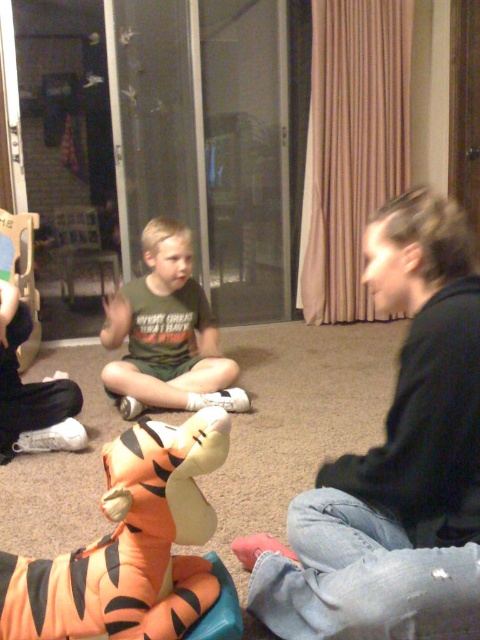
You are standing in the room and want to place a new decorative item exactly where the orange plush tiger at lower left is currently located. What are the coordinates of that location?

The coordinates of the location where the orange plush tiger at lower left is placed are at point (130,545).

You are organizing a childrens party and need to place the black cotton shirt at upper right and the orange plush tiger at lower left on a shelf. Which item requires more horizontal space on the shelf?

The black cotton shirt at upper right requires more horizontal space on the shelf because its width surpasses that of the orange plush tiger at lower left.